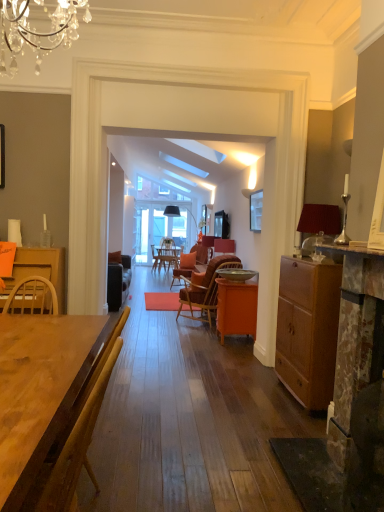
Question: Does orange matte cabinet at center, the second desk viewed from the left, lie in front of matte black speaker at center?

Choices:
 (A) no
 (B) yes

Answer: (B)

Question: Is orange matte cabinet at center, which appears as the first desk when viewed from the back, far away from matte black speaker at center?

Choices:
 (A) no
 (B) yes

Answer: (B)

Question: From the image's perspective, does orange matte cabinet at center, which appears as the first desk when viewed from the back, appear higher than matte black speaker at center?

Choices:
 (A) yes
 (B) no

Answer: (B)

Question: Is orange matte cabinet at center, which ranks as the 2th desk in front-to-back order, taller than matte black speaker at center?

Choices:
 (A) yes
 (B) no

Answer: (A)

Question: Could you tell me if orange matte cabinet at center, the second desk viewed from the left, is turned towards matte black speaker at center?

Choices:
 (A) no
 (B) yes

Answer: (A)

Question: From a real-world perspective, is orange matte cabinet at center, which ranks as the 2th desk in front-to-back order, above or below wooden table at center, the 2th desk in the back-to-front sequence?

Choices:
 (A) above
 (B) below

Answer: (B)

Question: In terms of size, does orange matte cabinet at center, which appears as the first desk when viewed from the back, appear bigger or smaller than wooden table at center, positioned as the 1th desk in front-to-back order?

Choices:
 (A) small
 (B) big

Answer: (B)

Question: Considering the positions of point (221, 343) and point (13, 400), is point (221, 343) closer or farther from the camera than point (13, 400)?

Choices:
 (A) closer
 (B) farther

Answer: (B)

Question: From their relative heights in the image, would you say orange matte cabinet at center, the second desk viewed from the left, is taller or shorter than wooden table at center, the 2th desk in the back-to-front sequence?

Choices:
 (A) tall
 (B) short

Answer: (B)

Question: Is matte brown cabinet at right inside or outside of matte black picture frame at upper center?

Choices:
 (A) inside
 (B) outside

Answer: (B)

Question: From a real-world perspective, is matte brown cabinet at right physically located above or below matte black picture frame at upper center?

Choices:
 (A) below
 (B) above

Answer: (A)

Question: Is matte brown cabinet at right wider or thinner than matte black picture frame at upper center?

Choices:
 (A) wide
 (B) thin

Answer: (A)

Question: From their relative heights in the image, would you say matte brown cabinet at right is taller or shorter than matte black picture frame at upper center?

Choices:
 (A) tall
 (B) short

Answer: (A)

Question: Considering the positions of orange matte cabinet at center, which ranks as the 2th desk in front-to-back order, and matte black speaker at center in the image, is orange matte cabinet at center, which ranks as the 2th desk in front-to-back order, taller or shorter than matte black speaker at center?

Choices:
 (A) tall
 (B) short

Answer: (A)

Question: Is orange matte cabinet at center, which ranks as the 2th desk in front-to-back order, in front of or behind matte black speaker at center in the image?

Choices:
 (A) behind
 (B) front

Answer: (B)